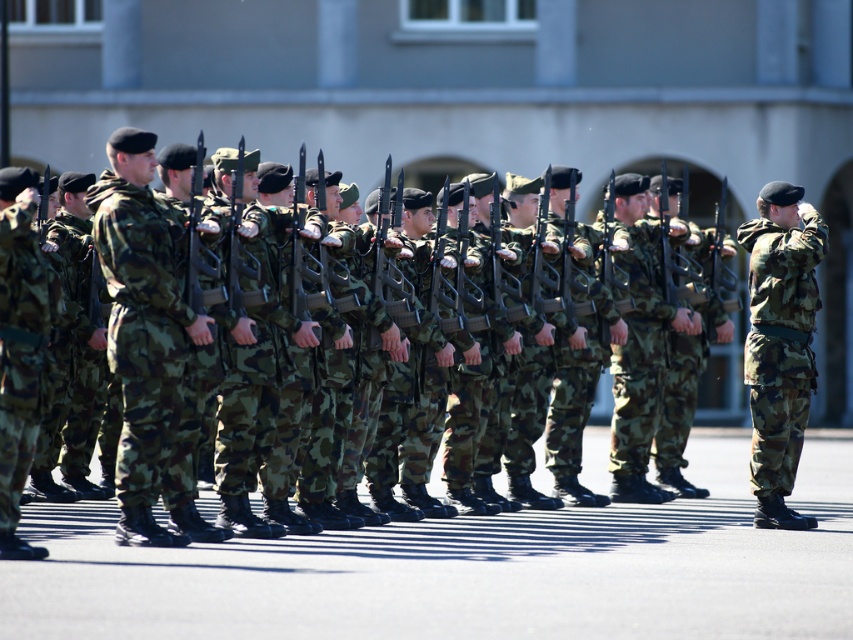
Question: Which object appears farthest from the camera in this image?

Choices:
 (A) camouflage fabric uniform at center
 (B) camouflage uniform at center
 (C) camo uniform at right
 (D) camouflage fabric uniform at left

Answer: (C)

Question: Does camouflage uniform at center have a greater width compared to camo fabric pants at center?

Choices:
 (A) yes
 (B) no

Answer: (A)

Question: Is camouflage fabric uniform at center further to camera compared to camo uniform at right?

Choices:
 (A) no
 (B) yes

Answer: (A)

Question: Does camouflage fabric uniform at center have a larger size compared to camo uniform at right?

Choices:
 (A) yes
 (B) no

Answer: (A)

Question: Which point is farther to the camera?

Choices:
 (A) (630, 276)
 (B) (212, 346)
 (C) (9, 310)

Answer: (A)

Question: Which point is closer to the camera taking this photo?

Choices:
 (A) (129, 332)
 (B) (16, 488)

Answer: (B)